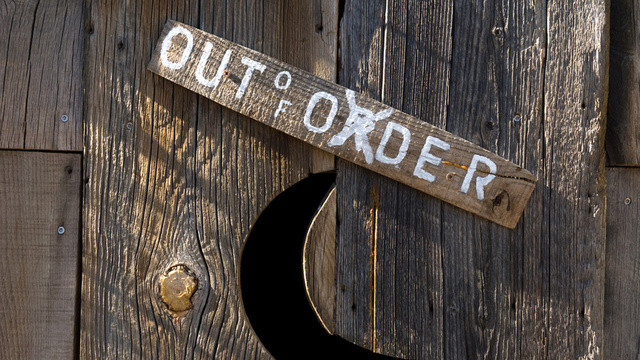
I want to click on screws, so click(63, 121), click(63, 227), click(129, 124), click(628, 200), click(520, 116).